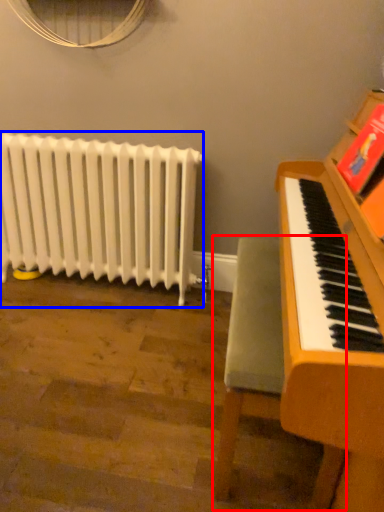
Question: Which point is further to the camera, armchair (highlighted by a red box) or radiator (highlighted by a blue box)?

Choices:
 (A) armchair
 (B) radiator

Answer: (B)